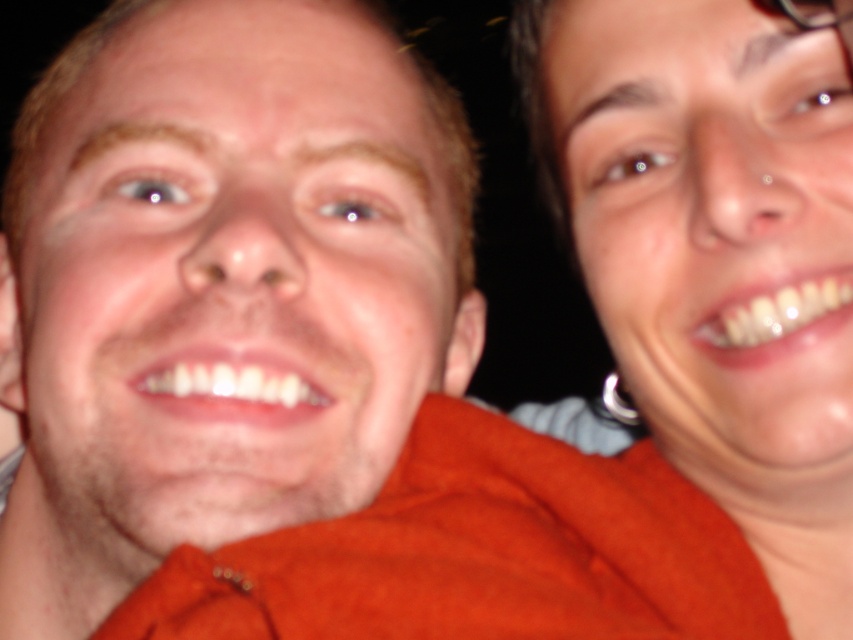
Question: Which object appears closest to the camera in this image?

Choices:
 (A) matte skin at right
 (B) matte orange shirt at left

Answer: (B)

Question: Which point appears closest to the camera in this image?

Choices:
 (A) (611, 161)
 (B) (373, 480)

Answer: (B)

Question: Can you confirm if matte orange shirt at left is positioned above matte skin at right?

Choices:
 (A) yes
 (B) no

Answer: (B)

Question: Is matte orange shirt at left bigger than matte skin at right?

Choices:
 (A) yes
 (B) no

Answer: (A)

Question: Is matte orange shirt at left thinner than matte skin at right?

Choices:
 (A) no
 (B) yes

Answer: (A)